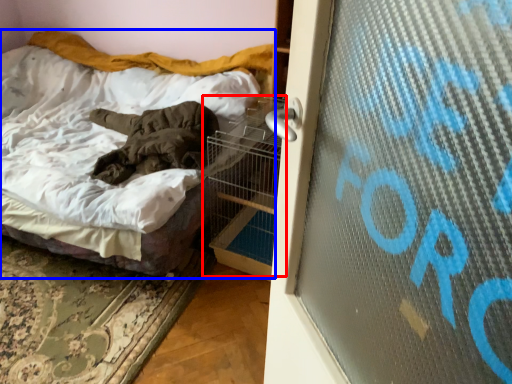
Question: Among these objects, which one is farthest to the camera, bird cage (highlighted by a red box) or bed (highlighted by a blue box)?

Choices:
 (A) bird cage
 (B) bed

Answer: (A)